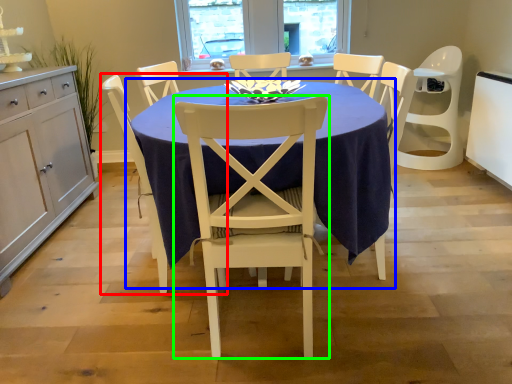
Question: Based on their relative distances, which object is farther from chair (highlighted by a red box)? Choose from kitchen & dining room table (highlighted by a blue box) and chair (highlighted by a green box).

Choices:
 (A) kitchen & dining room table
 (B) chair

Answer: (A)